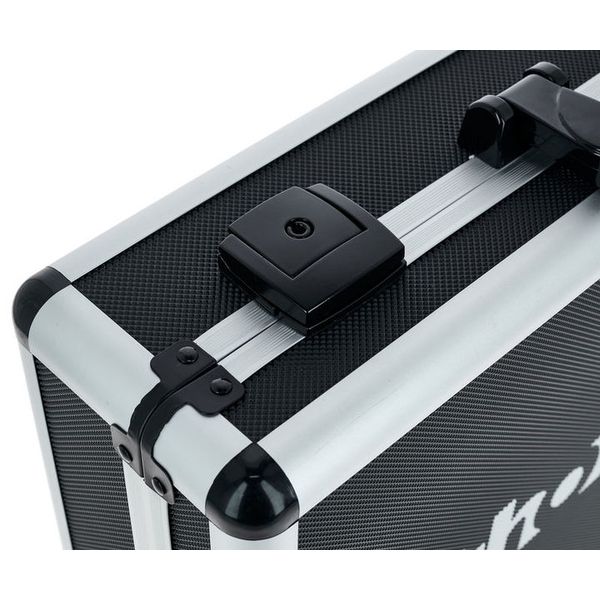
Find the location of `latch`. latch is located at coordinates (341, 273).